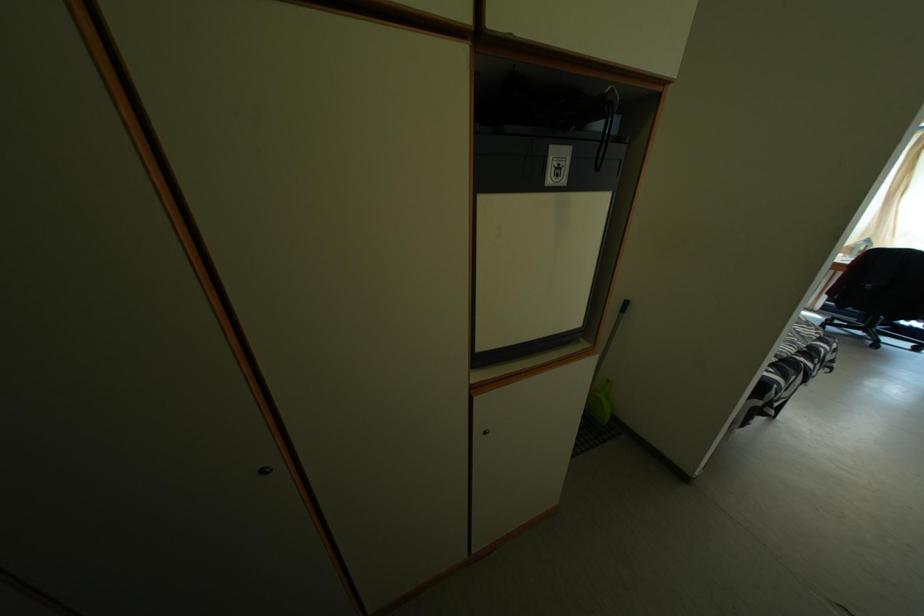
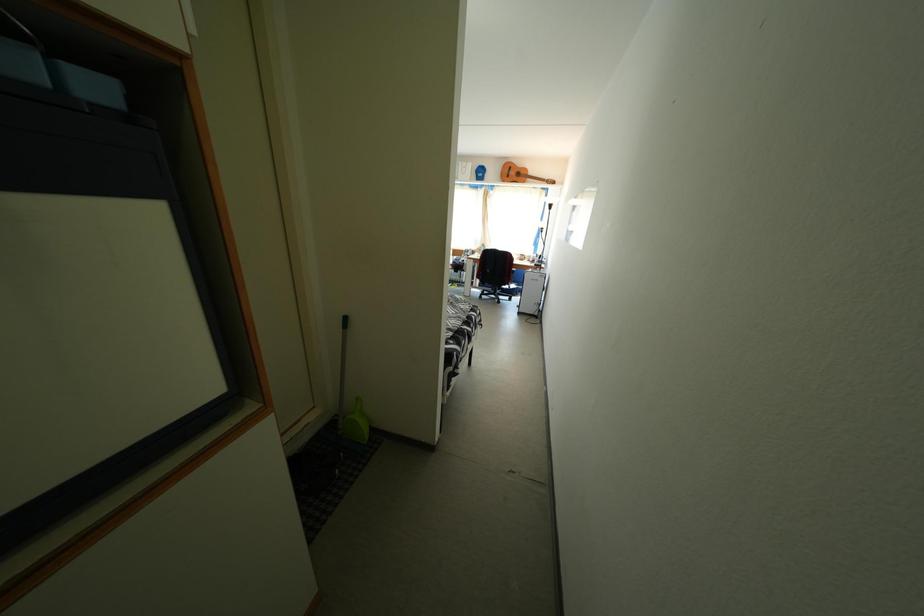
Question: The camera is either moving clockwise (left) or counter-clockwise (right) around the object. The first image is from the beginning of the video and the second image is from the end. Is the camera moving left or right when shooting the video?

Choices:
 (A) Left
 (B) Right

Answer: (A)